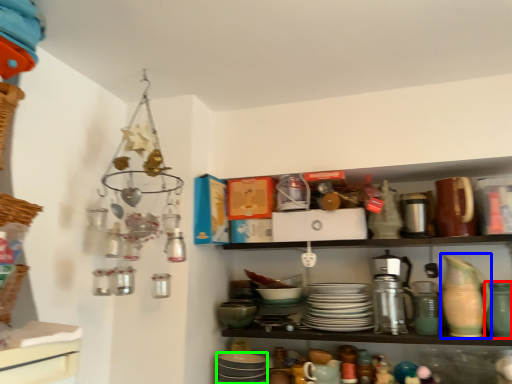
Question: Estimate the real-world distances between objects in this image. Which object is farther from tableware (highlighted by a red box), tableware (highlighted by a blue box) or tableware (highlighted by a green box)?

Choices:
 (A) tableware
 (B) tableware

Answer: (B)